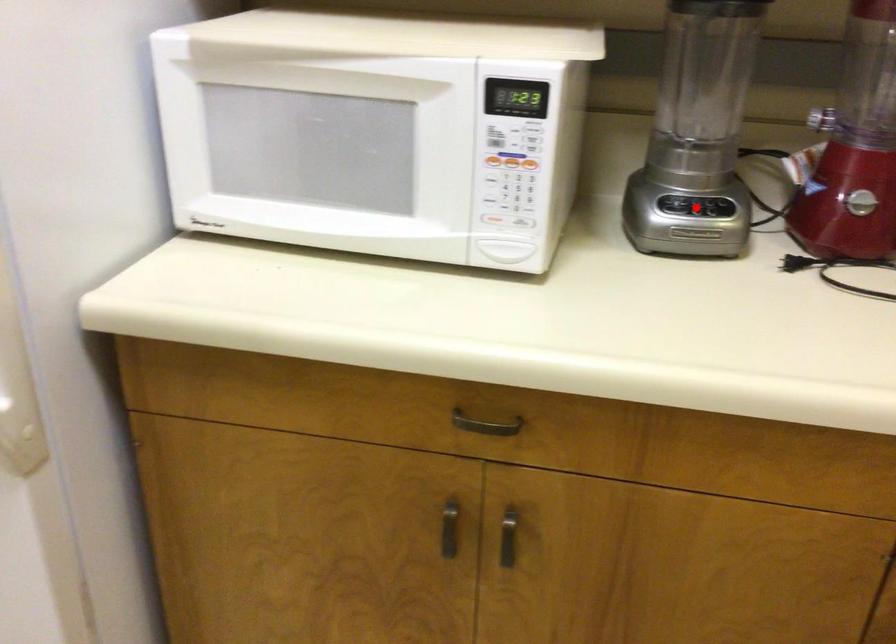
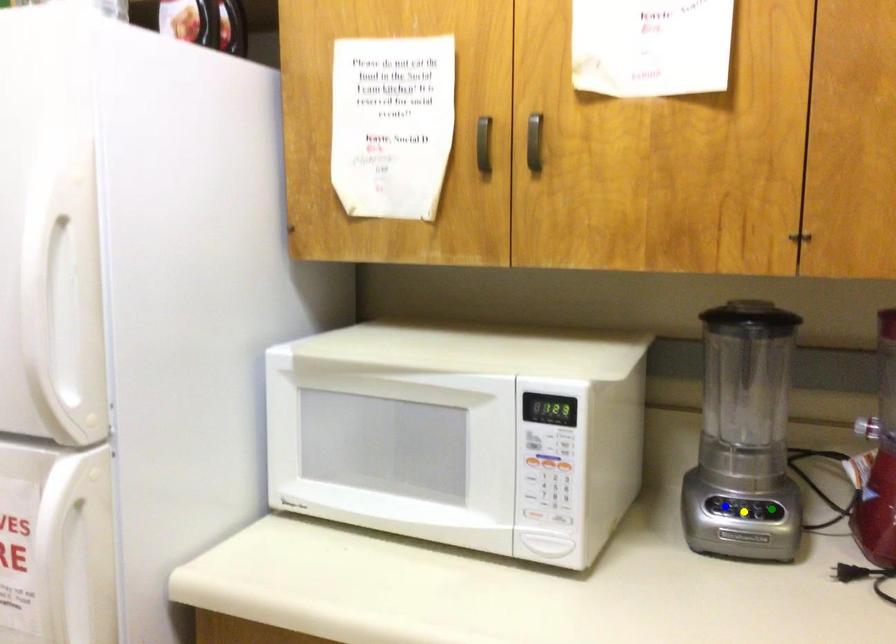
Question: I am providing you with two images of the same scene from different viewpoints. A red point is marked on the first image. You are given multiple points on the second image. In image 2, which mark is for the same physical point as the one in image 1?

Choices:
 (A) blue point
 (B) green point
 (C) yellow point

Answer: (C)